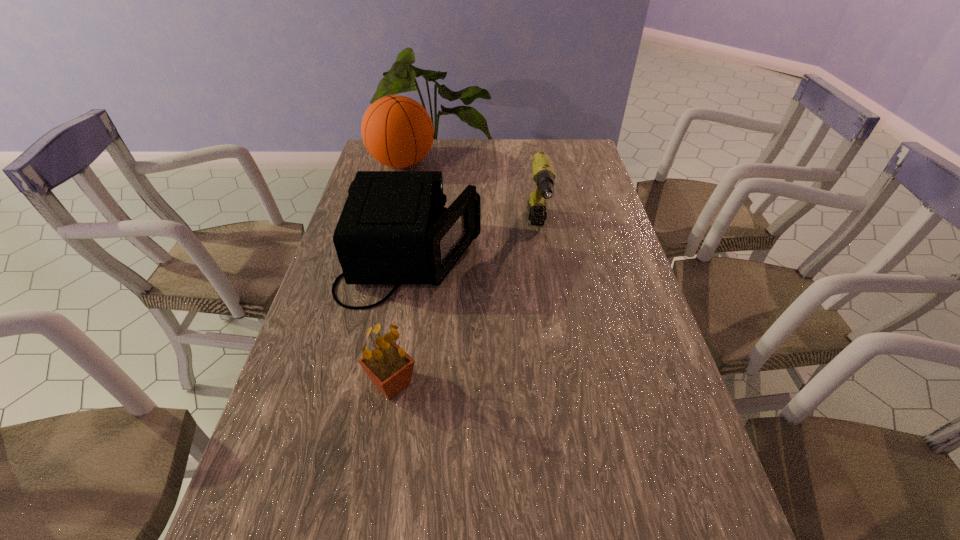
The image size is (960, 540). Find the location of `microwave oven positioned at the left edge`. microwave oven positioned at the left edge is located at coordinates (394, 229).

Identify the location of object that is positioned at the far left corner. This screenshot has height=540, width=960. (397, 131).

Where is `blank space at the far edge of the desktop`? The height and width of the screenshot is (540, 960). blank space at the far edge of the desktop is located at coordinates (473, 168).

In order to click on vacant space at the left edge of the desktop in this screenshot , I will do `click(325, 384)`.

Identify the location of blank area at the right edge. (595, 195).

In the image, there is a desktop. At what (x,y) coordinates should I click in order to perform the action: click on vacant space at the far right corner. Please return your answer as a coordinate pair (x, y). Looking at the image, I should click on (571, 152).

Where is `free space between the drill and the microwave oven`? The image size is (960, 540). free space between the drill and the microwave oven is located at coordinates (475, 244).

You are a GUI agent. You are given a task and a screenshot of the screen. Output one action in this format:
    pyautogui.click(x=<x>, y=<y>)
    Task: Click on the empty space that is in between the rightmost object and the nearest object
    
    Given the screenshot: What is the action you would take?
    pyautogui.click(x=465, y=307)

Locate which object is the closest to the microwave oven. Please provide its 2D coordinates. Your answer should be formatted as a tuple, i.e. [(x, y)], where the tuple contains the x and y coordinates of a point satisfying the conditions above.

[(543, 173)]

Where is `object that is the second closest to the microwave oven`? object that is the second closest to the microwave oven is located at coordinates (390, 368).